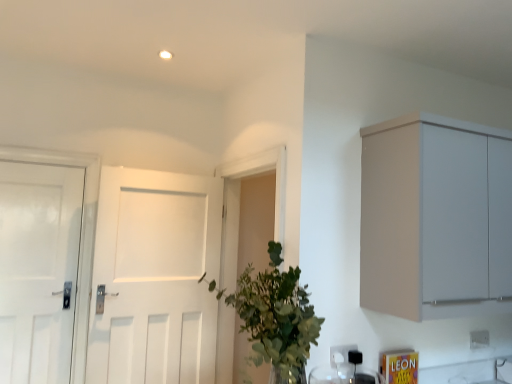
Question: Does white matte door at center, which ranks as the second door in left-to-right order, come in front of white plastic electric outlet at lower center, positioned as the first electric outlet in left-to-right order?

Choices:
 (A) no
 (B) yes

Answer: (A)

Question: Considering the relative sizes of white matte door at center, the first door when ordered from right to left, and white plastic electric outlet at lower center, positioned as the first electric outlet in left-to-right order, in the image provided, is white matte door at center, the first door when ordered from right to left, wider than white plastic electric outlet at lower center, positioned as the first electric outlet in left-to-right order,?

Choices:
 (A) no
 (B) yes

Answer: (B)

Question: Is white matte door at center, which ranks as the second door in left-to-right order, located outside white plastic electric outlet at lower center, positioned as the first electric outlet in left-to-right order?

Choices:
 (A) no
 (B) yes

Answer: (B)

Question: From the image's perspective, is white matte door at center, which ranks as the second door in left-to-right order, under white plastic electric outlet at lower center, the second electric outlet when ordered from right to left?

Choices:
 (A) yes
 (B) no

Answer: (B)

Question: Does white matte door at center, the first door when ordered from right to left, appear on the right side of white plastic electric outlet at lower center, which is the 1th electric outlet from front to back?

Choices:
 (A) no
 (B) yes

Answer: (A)

Question: Does white matte door at center, the first door when ordered from right to left, have a greater height compared to white plastic electric outlet at lower center, positioned as the first electric outlet in left-to-right order?

Choices:
 (A) no
 (B) yes

Answer: (B)

Question: From a real-world perspective, is green leafy plant at center positioned over white plastic electric outlet at lower right, the 2th electric outlet positioned from the left, based on gravity?

Choices:
 (A) yes
 (B) no

Answer: (A)

Question: Is green leafy plant at center facing away from white plastic electric outlet at lower right, which is counted as the first electric outlet, starting from the right?

Choices:
 (A) no
 (B) yes

Answer: (B)

Question: From the image's perspective, is green leafy plant at center located beneath white plastic electric outlet at lower right, the 2th electric outlet positioned from the left?

Choices:
 (A) yes
 (B) no

Answer: (B)

Question: Is green leafy plant at center bigger than white plastic electric outlet at lower right, the 2th electric outlet positioned from the left?

Choices:
 (A) yes
 (B) no

Answer: (A)

Question: Is white plastic electric outlet at lower right, marked as the second electric outlet in a front-to-back arrangement, located within green leafy plant at center?

Choices:
 (A) no
 (B) yes

Answer: (A)

Question: Is green leafy plant at center further to camera compared to white plastic electric outlet at lower right, the 1th electric outlet in the back-to-front sequence?

Choices:
 (A) yes
 (B) no

Answer: (B)

Question: Is white plastic electric outlet at lower center, which is the 1th electric outlet from front to back, not close to green leafy plant at center?

Choices:
 (A) yes
 (B) no

Answer: (B)